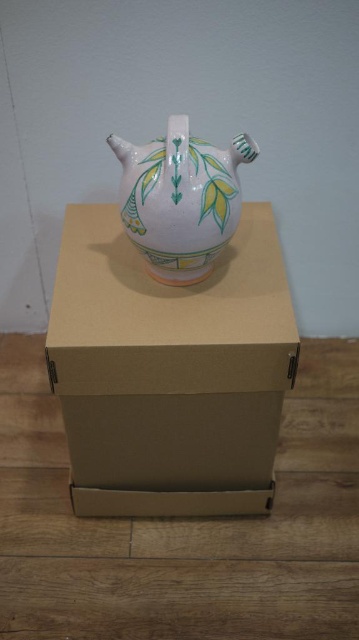
Is brown cardboard box at center bigger than porcelain teapot at center?

Indeed, brown cardboard box at center has a larger size compared to porcelain teapot at center.

Does brown cardboard box at center appear over porcelain teapot at center?

Incorrect, brown cardboard box at center is not positioned above porcelain teapot at center.

Is point (112, 412) more distant than point (203, 241)?

That is True.

I want to click on brown cardboard box at center, so click(170, 371).